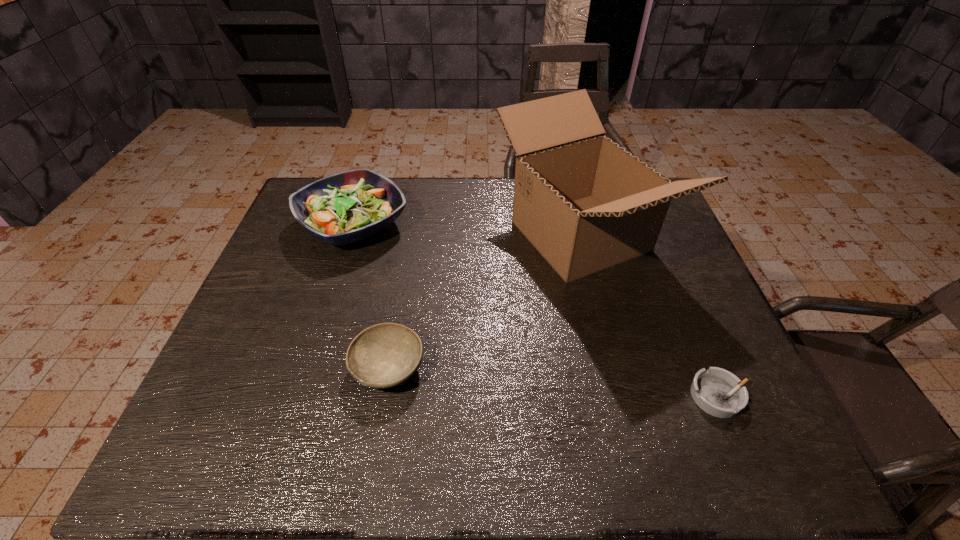
I want to click on vacant space that satisfies the following two spatial constraints: 1. on the back side of the tallest object; 2. on the right side of the bowl, so click(411, 236).

Identify the location of vacant space that satisfies the following two spatial constraints: 1. on the front side of the box; 2. on the left side of the ashtray. The height and width of the screenshot is (540, 960). (620, 396).